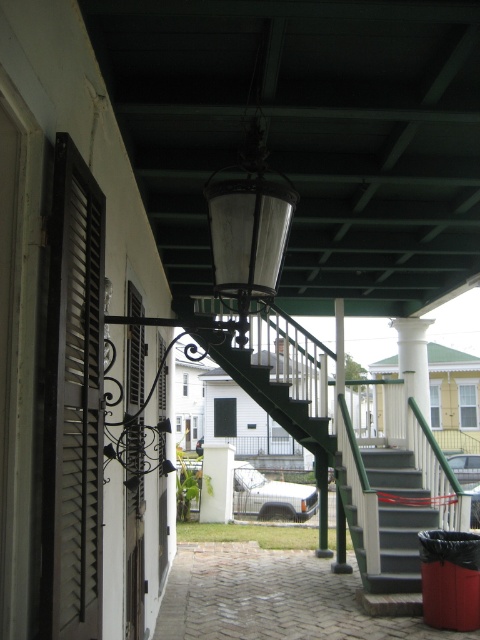
Based on the photo, you are standing at the bottom of the staircase on the porch and want to walk towards the white door. There are two points marked on the ground, point (54, 412) and point (140, 497). Which point should you step on first while moving towards the door?

You should step on point (54, 412) first because it is in front of point (140, 497) along the path towards the white door.

You are a painter who needs to decide which object to paint first. The black matte shutters at left and the dark gray concrete stairs at center are both in your current view. Based on their thickness, which object is narrower?

The black matte shutters at left is thinner than dark gray concrete stairs at center, so the black matte shutters at left is narrower.